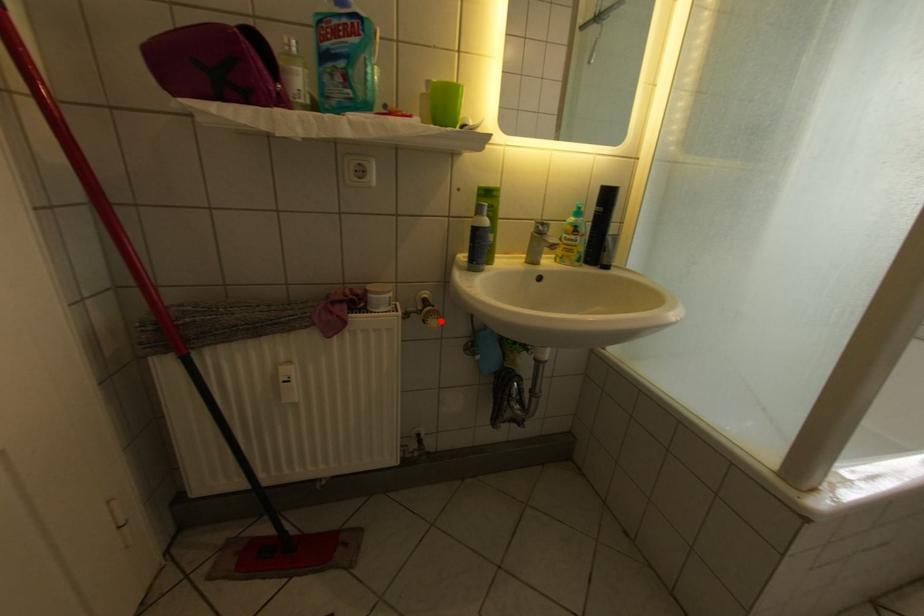
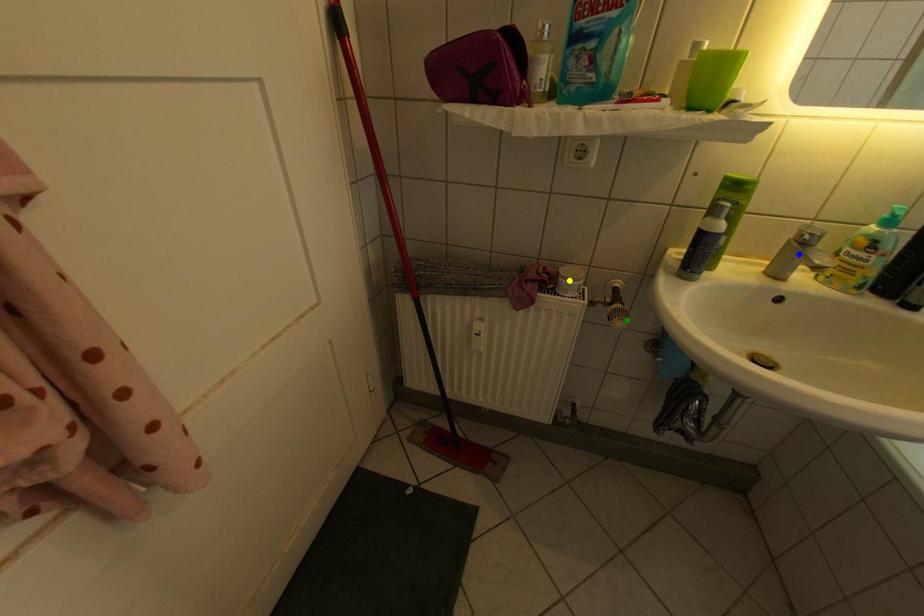
Question: I am providing you with two images of the same scene from different viewpoints. A red point is marked on the first image. You are given multiple points on the second image. Which spot in image 2 lines up with the point in image 1?

Choices:
 (A) blue point
 (B) yellow point
 (C) green point

Answer: (C)